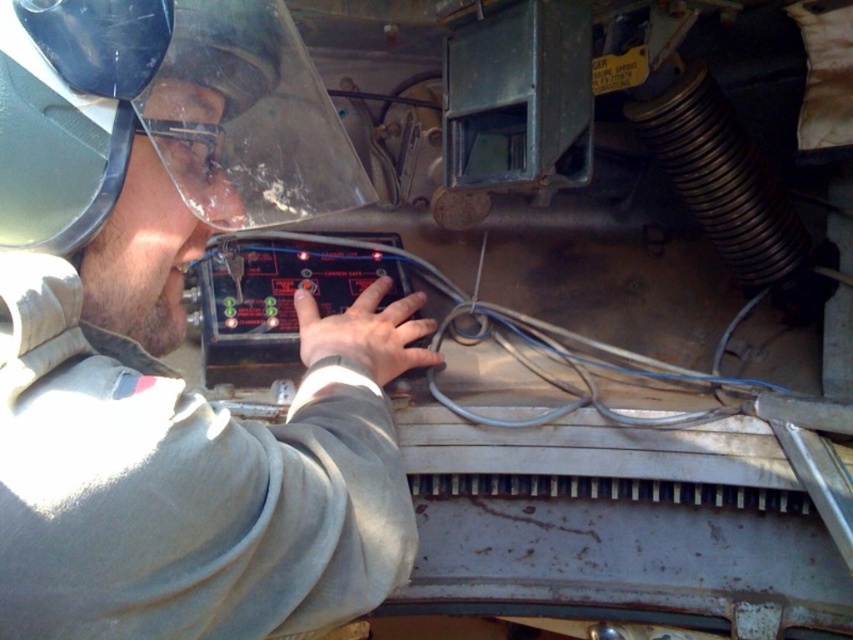
Question: Is matte black control panel at center bigger than clear plastic helmet at upper left?

Choices:
 (A) yes
 (B) no

Answer: (A)

Question: Estimate the real-world distances between objects in this image. Which object is farther from the transparent plastic goggles at upper center?

Choices:
 (A) clear plastic helmet at upper left
 (B) matte black control panel at center

Answer: (B)

Question: Which of these objects is positioned closest to the matte black control panel at center?

Choices:
 (A) clear plastic helmet at upper left
 (B) transparent plastic goggles at upper center

Answer: (A)

Question: Is matte black control panel at center closer to camera compared to transparent plastic goggles at upper center?

Choices:
 (A) no
 (B) yes

Answer: (B)

Question: Which of the following is the closest to the observer?

Choices:
 (A) (347, 372)
 (B) (218, 161)
 (C) (113, 180)

Answer: (C)

Question: Does matte black control panel at center appear under clear plastic helmet at upper left?

Choices:
 (A) yes
 (B) no

Answer: (A)